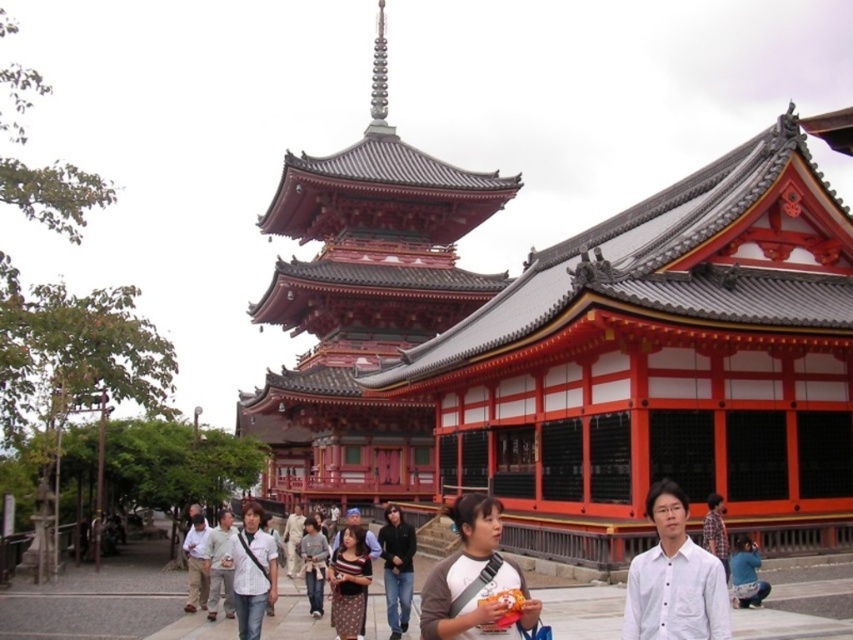
Does point (396, 548) come farther from viewer compared to point (744, 541)?

Yes, point (396, 548) is behind point (744, 541).

This screenshot has width=853, height=640. I want to click on black leather jacket at center, so click(x=397, y=568).

Who is lower down, white matte shirt at center or light brown fabric pants at center?

Positioned lower is light brown fabric pants at center.

Consider the image. Is white matte shirt at center wider than light brown fabric pants at center?

In fact, white matte shirt at center might be narrower than light brown fabric pants at center.

Where is `white matte shirt at center`? This screenshot has height=640, width=853. white matte shirt at center is located at coordinates (674, 579).

Who is positioned more to the right, matte gray shirt at center or white matte shirt at center?

white matte shirt at center is more to the right.

Is matte gray shirt at center taller than white matte shirt at center?

Yes, matte gray shirt at center is taller than white matte shirt at center.

Image resolution: width=853 pixels, height=640 pixels. I want to click on matte gray shirt at center, so click(476, 580).